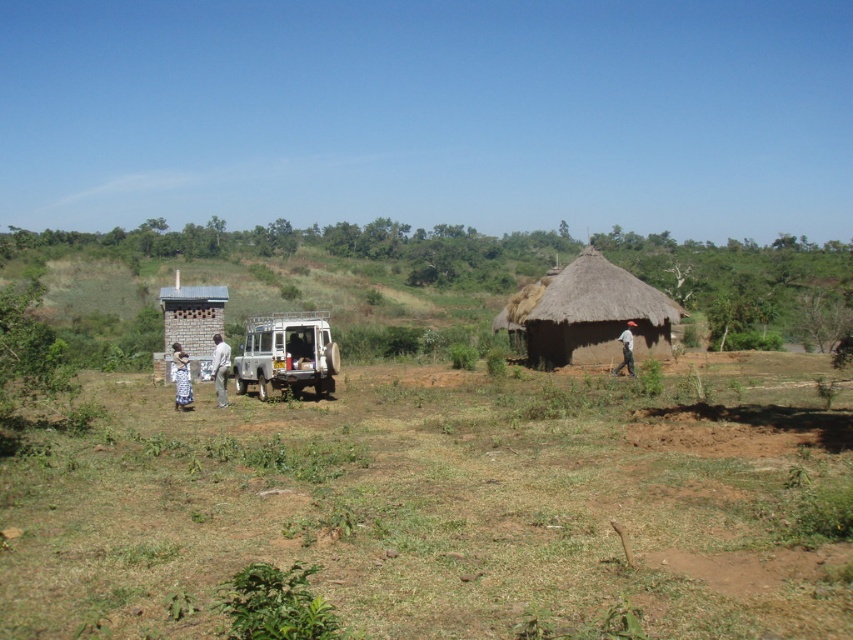
Where is `thatched straw hut at right`? thatched straw hut at right is located at coordinates (595, 314).

Which is in front, point (527, 323) or point (223, 348)?

Point (223, 348) is in front.

Does point (561, 321) come behind point (212, 337)?

That is False.

Where is `thatched straw hut at right`? This screenshot has height=640, width=853. thatched straw hut at right is located at coordinates (595, 314).

In the scene shown: Between brown thatch hut at center and white lace dress at left, which one appears on the left side from the viewer's perspective?

Positioned to the left is white lace dress at left.

Can you confirm if brown thatch hut at center is positioned to the right of white lace dress at left?

Correct, you'll find brown thatch hut at center to the right of white lace dress at left.

Describe the element at coordinates (447, 502) in the screenshot. I see `brown thatch hut at center` at that location.

Locate an element on the screen. Image resolution: width=853 pixels, height=640 pixels. brown thatch hut at center is located at coordinates (447, 502).

Which is in front, point (541, 493) or point (218, 378)?

Point (541, 493) is more forward.

Does point (485, 451) lie in front of point (221, 364)?

Yes, it is in front of point (221, 364).

The image size is (853, 640). Identify the location of brown thatch hut at center. (447, 502).